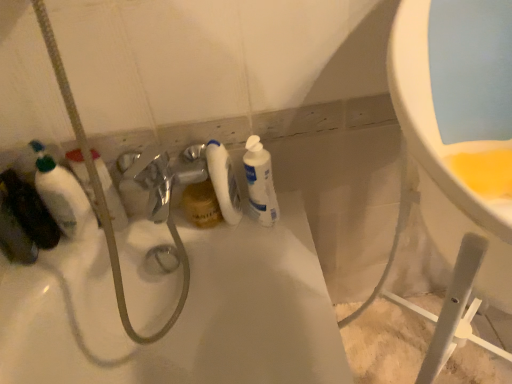
Question: Considering the relative positions of white matte bottle at center, the 2th cleaning product from the right, and white glossy bottle at center, which ranks as the second cleaning product in left-to-right order, in the image provided, is white matte bottle at center, the 2th cleaning product from the right, to the left of white glossy bottle at center, which ranks as the second cleaning product in left-to-right order, from the viewer's perspective?

Choices:
 (A) no
 (B) yes

Answer: (B)

Question: Is white matte bottle at center, the first cleaning product when ordered from left to right, touching white glossy bottle at center, which ranks as the second cleaning product in left-to-right order?

Choices:
 (A) yes
 (B) no

Answer: (A)

Question: Is white matte bottle at center, the 2th cleaning product from the right, at the right side of white glossy bottle at center, which ranks as the second cleaning product in left-to-right order?

Choices:
 (A) yes
 (B) no

Answer: (B)

Question: From the image's perspective, is white matte bottle at center, the 2th cleaning product from the right, on top of white glossy bottle at center, which appears as the 1th cleaning product when viewed from the right?

Choices:
 (A) yes
 (B) no

Answer: (A)

Question: Is the position of white matte bottle at center, the 2th cleaning product from the right, more distant than that of white glossy bottle at center, which appears as the 1th cleaning product when viewed from the right?

Choices:
 (A) yes
 (B) no

Answer: (A)

Question: Is white matte bottle at center, the first cleaning product when ordered from left to right, outside of white glossy bottle at center, which ranks as the second cleaning product in left-to-right order?

Choices:
 (A) yes
 (B) no

Answer: (A)

Question: Would you say white matte bottle at center, the first cleaning product when ordered from left to right, is part of white glossy bottle at center, which appears as the 1th cleaning product when viewed from the right,'s contents?

Choices:
 (A) no
 (B) yes

Answer: (A)

Question: Does white glossy bottle at center, which ranks as the second cleaning product in left-to-right order, have a greater height compared to white matte bottle at center, the first cleaning product when ordered from left to right?

Choices:
 (A) yes
 (B) no

Answer: (B)

Question: From a real-world perspective, is white glossy bottle at center, which appears as the 1th cleaning product when viewed from the right, physically above white matte bottle at center, the 2th cleaning product from the right?

Choices:
 (A) no
 (B) yes

Answer: (A)

Question: Does white glossy bottle at center, which appears as the 1th cleaning product when viewed from the right, have a smaller size compared to white matte bottle at center, the 2th cleaning product from the right?

Choices:
 (A) no
 (B) yes

Answer: (A)

Question: Is white glossy bottle at center, which ranks as the second cleaning product in left-to-right order, oriented away from white matte bottle at center, the first cleaning product when ordered from left to right?

Choices:
 (A) yes
 (B) no

Answer: (B)

Question: Is white glossy bottle at center, which ranks as the second cleaning product in left-to-right order, to the left of white matte bottle at center, the 2th cleaning product from the right, from the viewer's perspective?

Choices:
 (A) yes
 (B) no

Answer: (B)

Question: Considering the positions of white glossy bottle at center, which ranks as the second cleaning product in left-to-right order, and white matte bottle at center, the 2th cleaning product from the right, in the image, is white glossy bottle at center, which ranks as the second cleaning product in left-to-right order, wider or thinner than white matte bottle at center, the 2th cleaning product from the right,?

Choices:
 (A) thin
 (B) wide

Answer: (B)